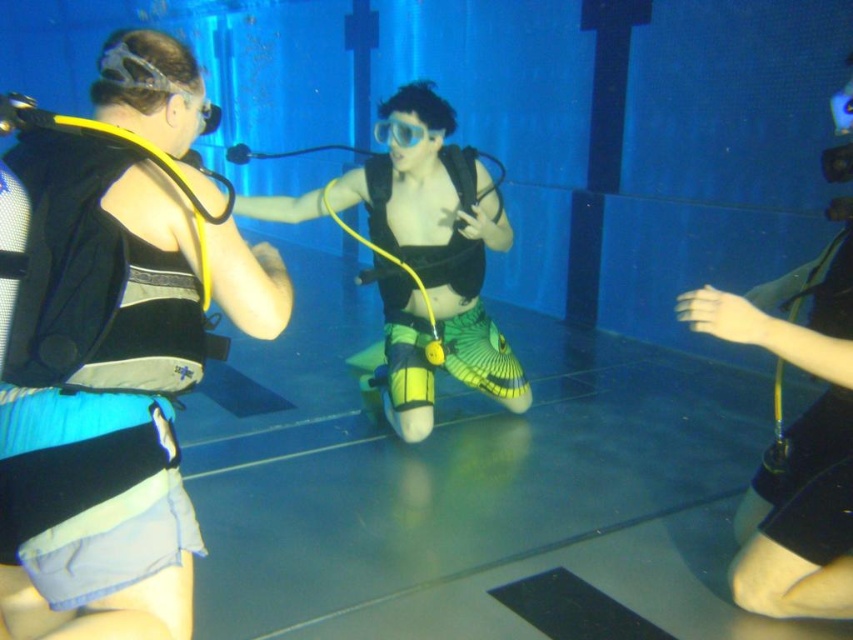
Is blue mesh vest at left smaller than transparent plastic goggles at center?

No, blue mesh vest at left is not smaller than transparent plastic goggles at center.

Who is more forward, [86,436] or [404,132]?

Point [86,436]

Locate an element on the screen. blue mesh vest at left is located at coordinates (112, 349).

Which of these two, neon green fabric fins at center or transparent plastic goggles at center, stands shorter?

With less height is transparent plastic goggles at center.

The image size is (853, 640). What are the coordinates of `neon green fabric fins at center` in the screenshot? It's located at (440, 237).

Who is taller, blue mesh vest at left or neon green fabric fins at center?

neon green fabric fins at center

The height and width of the screenshot is (640, 853). What are the coordinates of `blue mesh vest at left` in the screenshot? It's located at (112, 349).

At what (x,y) coordinates should I click in order to perform the action: click on blue mesh vest at left. Please return your answer as a coordinate pair (x, y). Looking at the image, I should click on (112, 349).